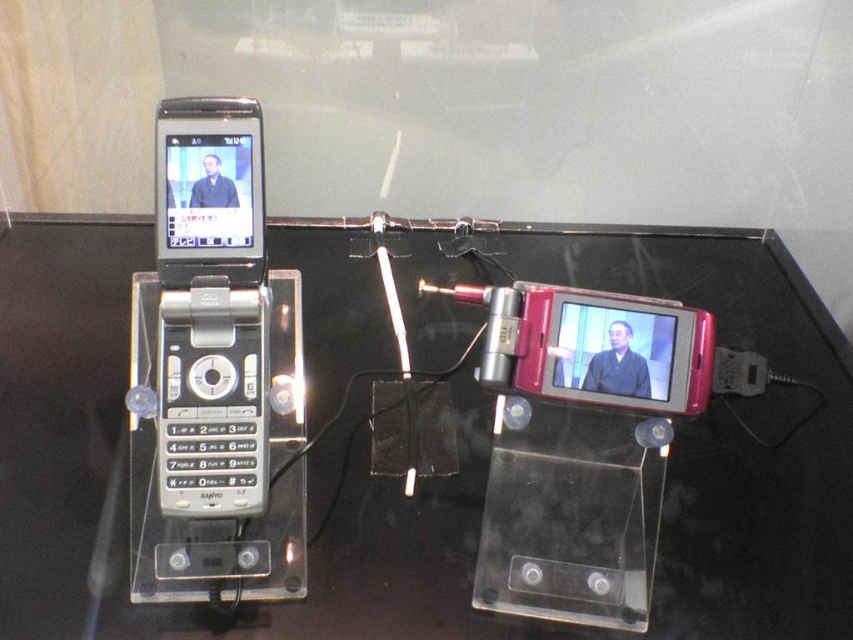
Who is higher up, black glossy glass table at center or matte black flip phone at left?

Positioned higher is matte black flip phone at left.

Is black glossy glass table at center positioned in front of matte black flip phone at left?

No, it is behind matte black flip phone at left.

Where is `black glossy glass table at center`? Image resolution: width=853 pixels, height=640 pixels. black glossy glass table at center is located at coordinates (735, 432).